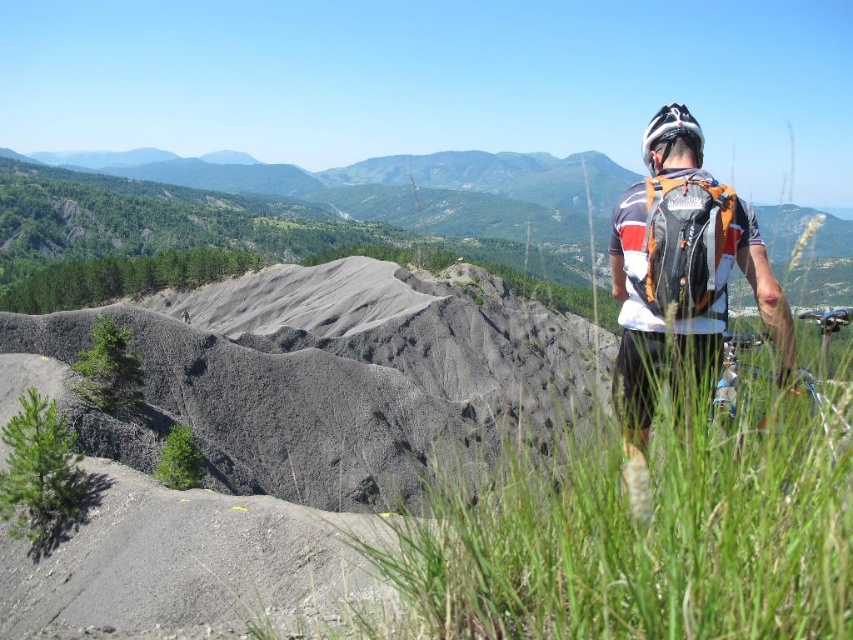
You are standing at the base of the mountain and see the green grass at lower right and the white matte bicycle helmet at upper right. Which object is nearer to you?

The green grass at lower right is closer to the viewer than the white matte bicycle helmet at upper right.

You are planning to ride the shiny metallic bicycle at right to reach the white matte bicycle helmet at upper right. Given that the bicycle can travel at a maximum speed of 15 km per hour, how long would it take you to reach the helmet?

The shiny metallic bicycle at right and white matte bicycle helmet at upper right are 83.21 meters apart from each other. At a speed of 15 km per hour, converting that to meters per second is approximately 4.17 m per second. Dividing the distance by speed gives roughly 20 seconds. So, it would take approximately 20 seconds to reach the helmet.

You are an outdoor enthusiast planning to set up a tent. You have a tent that requires a flat area of at least 2 meters by 2 meters. Looking at the scene, can you determine if the green grass at lower right and the shiny metallic bicycle at right provide enough space for the tent? Please consider the positioning of both objects.

The green grass at lower right is positioned on the left side of the shiny metallic bicycle at right. Since the bicycle is at the right, the grass area might be adjacent but the description does not specify the distance between them. However, the rocky terrain in the midground suggests uneven ground, which may not provide a flat area large enough for the tent. Therefore, it is uncertain if the space between them meets the flatness requirement, but the proximity might offer sufficient space if the ground is